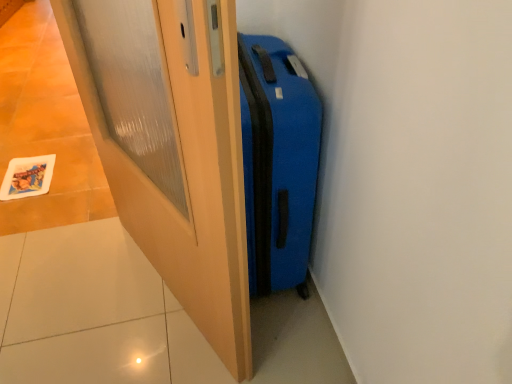
Find the location of a particular element. Image resolution: width=512 pixels, height=384 pixels. vacant region in front of blue matte suitcase at center is located at coordinates (265, 346).